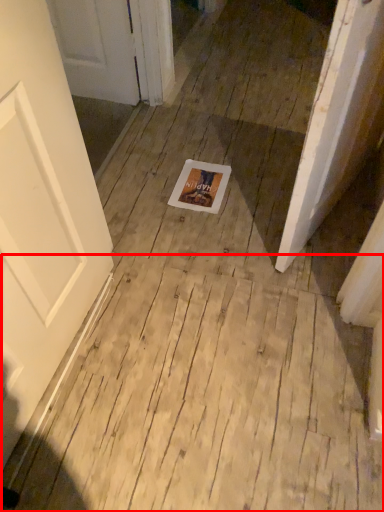
Question: Observing the image, what is the correct spatial positioning of plywood (annotated by the red box) in reference to postcard?

Choices:
 (A) left
 (B) right

Answer: (B)